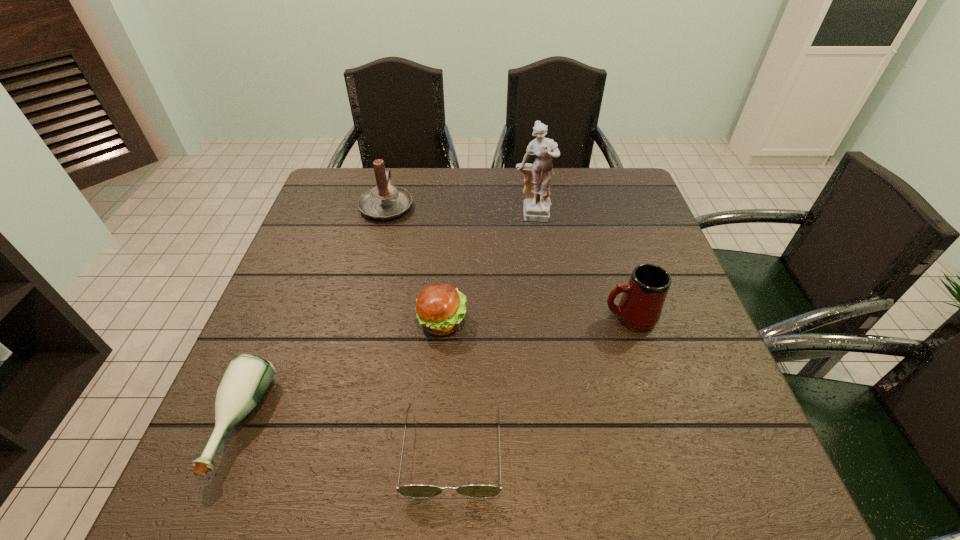
Identify the location of the fifth object from left to right. The image size is (960, 540). (536, 206).

You are a GUI agent. You are given a task and a screenshot of the screen. Output one action in this format:
    pyautogui.click(x=<x>, y=<y>)
    Task: Click on the tallest object
    The width and height of the screenshot is (960, 540).
    Given the screenshot: What is the action you would take?
    pyautogui.click(x=536, y=206)

I want to click on the fifth object from right to left, so click(384, 201).

This screenshot has height=540, width=960. Identify the location of the second tallest object. (384, 201).

At what (x,y) coordinates should I click in order to perform the action: click on the rightmost object. Please return your answer as a coordinate pair (x, y). Looking at the image, I should click on (640, 307).

Image resolution: width=960 pixels, height=540 pixels. I want to click on the third tallest object, so click(640, 307).

Identify the location of hamburger. This screenshot has height=540, width=960. (440, 308).

Image resolution: width=960 pixels, height=540 pixels. I want to click on bottle, so click(247, 377).

The width and height of the screenshot is (960, 540). In order to click on the shortest object in this screenshot , I will do `click(417, 491)`.

Locate an element on the screen. The width and height of the screenshot is (960, 540). vacant region located on the front-facing side of the tallest object is located at coordinates (544, 307).